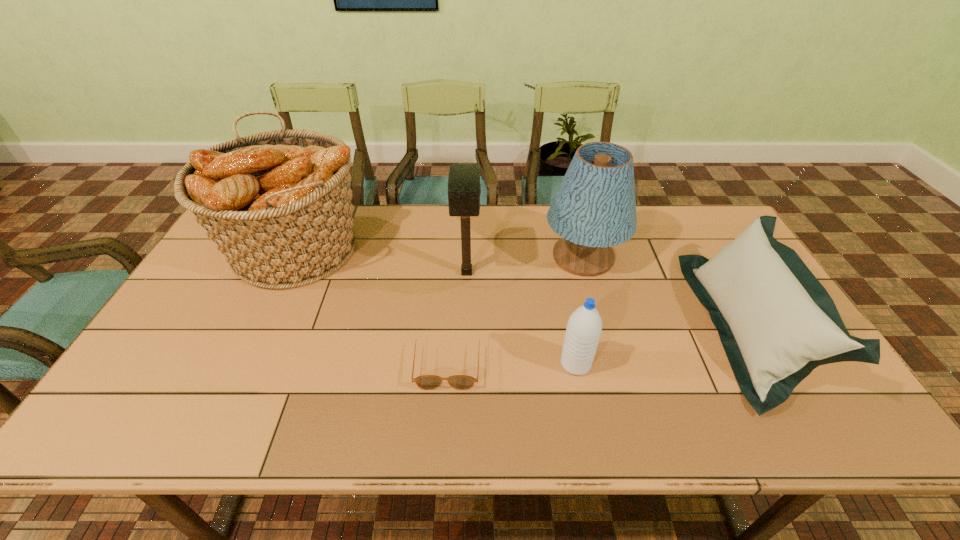
This screenshot has width=960, height=540. I want to click on free spot between the mallet and the rightmost object, so click(607, 300).

I want to click on free spot between the rightmost object and the mallet, so pos(607,300).

In order to click on vacant space that's between the leftmost object and the water bottle in this screenshot , I will do `click(436, 306)`.

Identify the location of free area in between the leftmost object and the water bottle. (436, 306).

At what (x,y) coordinates should I click in order to perform the action: click on the closest object to the lampshade. Please return your answer as a coordinate pair (x, y). This screenshot has width=960, height=540. Looking at the image, I should click on (777, 323).

Choose which object is the second nearest neighbor to the water bottle. Please provide its 2D coordinates. Your answer should be formatted as a tuple, i.e. [(x, y)], where the tuple contains the x and y coordinates of a point satisfying the conditions above.

[(594, 208)]